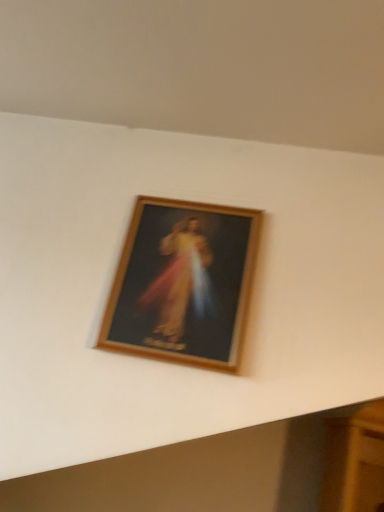
The image size is (384, 512). Describe the element at coordinates (183, 283) in the screenshot. I see `wooden picture frame at upper center` at that location.

Image resolution: width=384 pixels, height=512 pixels. In order to click on wooden picture frame at upper center in this screenshot , I will do `click(183, 283)`.

What is the approximate height of wooden picture frame at upper center?

It is 11.28 inches.

Where is `wooden picture frame at upper center`? This screenshot has height=512, width=384. wooden picture frame at upper center is located at coordinates (183, 283).